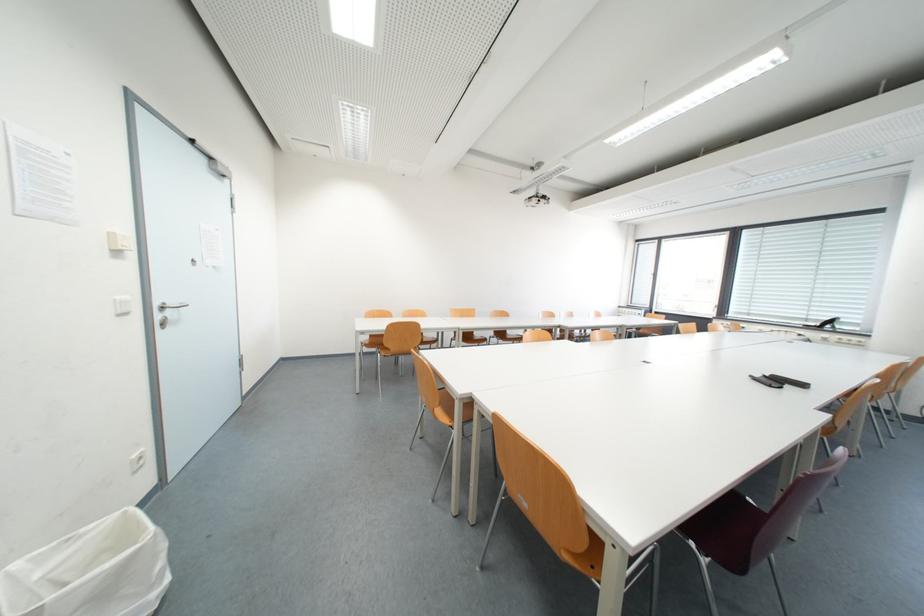
You are a GUI agent. You are given a task and a screenshot of the screen. Output one action in this format:
    pyautogui.click(x=<x>, y=<y>)
    Task: Click on the square wall switch
    
    Given the screenshot: What is the action you would take?
    pyautogui.click(x=122, y=305)